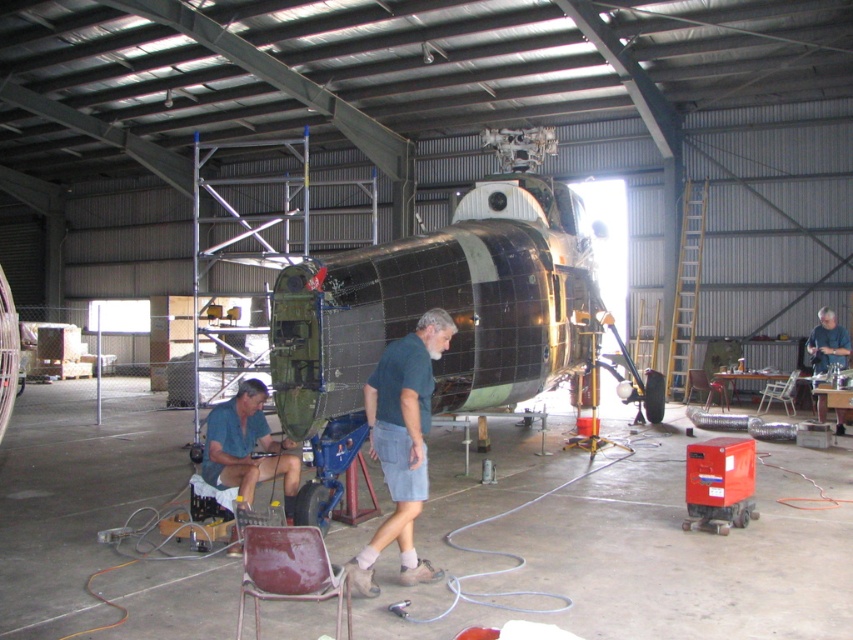
What is located at the coordinates point (247, 448) in the hangar?

A brushed metal shirt at lower left is located at point (247, 448).

You are standing in the hangar and want to inspect the metallic green helicopter at center. There is a dark green shirt at center in your way. Which object is closer to you, requiring you to move it first?

The metallic green helicopter at center is closer to you than the dark green shirt at center, so you need to move the dark green shirt at center first to access the helicopter.

You are standing in the hangar and need to locate the metallic maroon chair at lower center. According to the coordinates provided, where exactly should you look to find it?

The metallic maroon chair at lower center is located at the coordinates point (x=289, y=572).